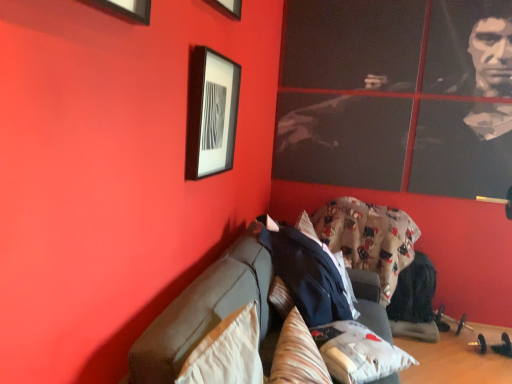
Based on the photo, how much space does fluffy white pillow at lower center, positioned as the first pillow in right-to-left order, occupy vertically?

5.21 inches.

Find the location of a particular element. This screenshot has width=512, height=384. dark gray fabric couch at center is located at coordinates (263, 322).

What is the approximate height of dark gray fabric couch at center?

Answer: It is 34.18 inches.

In order to click on striped fabric pillow at center, acting as the 2th pillow starting from the left in this screenshot , I will do `click(297, 355)`.

From the image's perspective, relative to fluffy white pillow at lower center, the 3th pillow from the left, is fluffy cotton blanket at center above or below?

fluffy cotton blanket at center is above fluffy white pillow at lower center, the 3th pillow from the left.

Based on the photo, is fluffy cotton blanket at center completely or partially outside of fluffy white pillow at lower center, the 3th pillow from the left?

Absolutely, fluffy cotton blanket at center is external to fluffy white pillow at lower center, the 3th pillow from the left.

How different are the orientations of fluffy cotton blanket at center and fluffy white pillow at lower center, the 3th pillow from the left, in degrees?

They differ by 133 degrees in their facing directions.

Is fluffy cotton blanket at center at the left side of fluffy white pillow at lower center, positioned as the first pillow in right-to-left order?

In fact, fluffy cotton blanket at center is to the right of fluffy white pillow at lower center, positioned as the first pillow in right-to-left order.

Which of these two, dark gray fabric couch at center or beige fabric pillow at lower left, placed as the 1th pillow when sorted from left to right, is bigger?

dark gray fabric couch at center is bigger.

Is dark gray fabric couch at center directly adjacent to beige fabric pillow at lower left, which is the third pillow from right to left?

They are not placed beside each other.

Based on the photo, is beige fabric pillow at lower left, placed as the 1th pillow when sorted from left to right, completely or partially inside dark gray fabric couch at center?

That's correct, beige fabric pillow at lower left, placed as the 1th pillow when sorted from left to right, is inside dark gray fabric couch at center.

Considering the sizes of objects dark gray fabric couch at center and beige fabric pillow at lower left, which is the third pillow from right to left, in the image provided, who is shorter, dark gray fabric couch at center or beige fabric pillow at lower left, which is the third pillow from right to left,?

With less height is beige fabric pillow at lower left, which is the third pillow from right to left.

Consider the image. Is fluffy cotton blanket at center aimed at matte black picture frame at upper left?

No, fluffy cotton blanket at center is not oriented towards matte black picture frame at upper left.

In terms of size, does fluffy cotton blanket at center appear bigger or smaller than matte black picture frame at upper left?

In the image, fluffy cotton blanket at center appears to be larger than matte black picture frame at upper left.

Is fluffy cotton blanket at center to the left of matte black picture frame at upper left from the viewer's perspective?

No.

What's the angular difference between fluffy cotton blanket at center and matte black picture frame at upper left's facing directions?

89.9 degrees.

Is beige fabric pillow at lower left, which is the third pillow from right to left, taller than fluffy cotton blanket at center?

Incorrect, the height of beige fabric pillow at lower left, which is the third pillow from right to left, is not larger of that of fluffy cotton blanket at center.

Is point (237, 328) positioned after point (376, 213)?

No, it is in front of (376, 213).

From the image's perspective, is beige fabric pillow at lower left, placed as the 1th pillow when sorted from left to right, above or below fluffy cotton blanket at center?

Clearly, from the image's perspective, beige fabric pillow at lower left, placed as the 1th pillow when sorted from left to right, is below fluffy cotton blanket at center.

Considering the relative sizes of beige fabric pillow at lower left, which is the third pillow from right to left, and fluffy cotton blanket at center in the image provided, is beige fabric pillow at lower left, which is the third pillow from right to left, thinner than fluffy cotton blanket at center?

Yes.

Considering the sizes of fluffy white pillow at lower center, the 3th pillow from the left, and dark gray fabric couch at center in the image, is fluffy white pillow at lower center, the 3th pillow from the left, wider or thinner than dark gray fabric couch at center?

Clearly, fluffy white pillow at lower center, the 3th pillow from the left, has less width compared to dark gray fabric couch at center.

Is fluffy white pillow at lower center, the 3th pillow from the left, to the right of dark gray fabric couch at center from the viewer's perspective?

Yes, fluffy white pillow at lower center, the 3th pillow from the left, is to the right of dark gray fabric couch at center.

Can you confirm if fluffy white pillow at lower center, the 3th pillow from the left, is taller than dark gray fabric couch at center?

In fact, fluffy white pillow at lower center, the 3th pillow from the left, may be shorter than dark gray fabric couch at center.

How much distance is there between fluffy white pillow at lower center, positioned as the first pillow in right-to-left order, and dark gray fabric couch at center?

fluffy white pillow at lower center, positioned as the first pillow in right-to-left order, is 9.15 inches from dark gray fabric couch at center.

From the image's perspective, is striped fabric pillow at center, acting as the 2th pillow starting from the left, above matte black picture frame at upper left?

Actually, striped fabric pillow at center, acting as the 2th pillow starting from the left, appears below matte black picture frame at upper left in the image.

Looking at the image, does striped fabric pillow at center, acting as the 2th pillow starting from the left, seem bigger or smaller compared to matte black picture frame at upper left?

Considering their sizes, striped fabric pillow at center, acting as the 2th pillow starting from the left, takes up more space than matte black picture frame at upper left.

From a real-world perspective, is striped fabric pillow at center, which is the 2th pillow in right-to-left order, beneath matte black picture frame at upper left?

Yes, from a real-world perspective, striped fabric pillow at center, which is the 2th pillow in right-to-left order, is under matte black picture frame at upper left.

Is matte black picture frame at upper left a part of striped fabric pillow at center, acting as the 2th pillow starting from the left?

Definitely not — matte black picture frame at upper left is not inside striped fabric pillow at center, acting as the 2th pillow starting from the left.

From a real-world perspective, is striped fabric pillow at center, acting as the 2th pillow starting from the left, below fluffy cotton blanket at center?

No, from a real-world perspective, striped fabric pillow at center, acting as the 2th pillow starting from the left, is not below fluffy cotton blanket at center.

Where is `blanket beneath the striped fabric pillow at center, which is the 2th pillow in right-to-left order (from a real-world perspective)`? The image size is (512, 384). blanket beneath the striped fabric pillow at center, which is the 2th pillow in right-to-left order (from a real-world perspective) is located at coordinates (369, 238).

Is striped fabric pillow at center, acting as the 2th pillow starting from the left, at the left side of fluffy cotton blanket at center?

Yes, striped fabric pillow at center, acting as the 2th pillow starting from the left, is to the left of fluffy cotton blanket at center.

Which object is closer to the camera, striped fabric pillow at center, acting as the 2th pillow starting from the left, or fluffy cotton blanket at center?

striped fabric pillow at center, acting as the 2th pillow starting from the left, is in front.

You are a GUI agent. You are given a task and a screenshot of the screen. Output one action in this format:
    pyautogui.click(x=<x>, y=<y>)
    Task: Click on the pillow that is the 3rd object located below the fluffy cotton blanket at center (from the image's perspective)
    The width and height of the screenshot is (512, 384).
    Given the screenshot: What is the action you would take?
    pyautogui.click(x=358, y=352)

Where is `the 1st pillow behind the dark gray fabric couch at center, starting your count from the anchor`? the 1st pillow behind the dark gray fabric couch at center, starting your count from the anchor is located at coordinates (227, 352).

Estimate the real-world distances between objects in this image. Which object is further from dark gray fabric couch at center, striped fabric pillow at center, acting as the 2th pillow starting from the left, or beige fabric pillow at lower left, placed as the 1th pillow when sorted from left to right?

Among the two, beige fabric pillow at lower left, placed as the 1th pillow when sorted from left to right, is located further to dark gray fabric couch at center.

From the image, which object appears to be farther from matte black picture frame at upper left, fluffy white pillow at lower center, the 3th pillow from the left, or fluffy cotton blanket at center?

The object further to matte black picture frame at upper left is fluffy cotton blanket at center.

From the image, which object appears to be nearer to striped fabric pillow at center, which is the 2th pillow in right-to-left order, dark gray fabric couch at center or beige fabric pillow at lower left, placed as the 1th pillow when sorted from left to right?

beige fabric pillow at lower left, placed as the 1th pillow when sorted from left to right.

Which object lies nearer to the anchor point fluffy white pillow at lower center, positioned as the first pillow in right-to-left order, dark gray fabric couch at center or matte black picture frame at upper left?

Based on the image, dark gray fabric couch at center appears to be nearer to fluffy white pillow at lower center, positioned as the first pillow in right-to-left order.

When comparing their distances from striped fabric pillow at center, which is the 2th pillow in right-to-left order, does beige fabric pillow at lower left, placed as the 1th pillow when sorted from left to right, or matte black picture frame at upper left seem closer?

beige fabric pillow at lower left, placed as the 1th pillow when sorted from left to right, lies closer to striped fabric pillow at center, which is the 2th pillow in right-to-left order, than the other object.

Which object lies further to the anchor point fluffy white pillow at lower center, positioned as the first pillow in right-to-left order, striped fabric pillow at center, acting as the 2th pillow starting from the left, or matte black picture frame at upper left?

matte black picture frame at upper left is positioned further to the anchor fluffy white pillow at lower center, positioned as the first pillow in right-to-left order.

Which object lies nearer to the anchor point dark gray fabric couch at center, beige fabric pillow at lower left, placed as the 1th pillow when sorted from left to right, or matte black picture frame at upper left?

beige fabric pillow at lower left, placed as the 1th pillow when sorted from left to right.

Estimate the real-world distances between objects in this image. Which object is closer to fluffy white pillow at lower center, positioned as the first pillow in right-to-left order, matte black picture frame at upper left or fluffy cotton blanket at center?

matte black picture frame at upper left lies closer to fluffy white pillow at lower center, positioned as the first pillow in right-to-left order, than the other object.

Where is `pillow between matte black picture frame at upper left and fluffy cotton blanket at center in the front-back direction`? The width and height of the screenshot is (512, 384). pillow between matte black picture frame at upper left and fluffy cotton blanket at center in the front-back direction is located at coordinates (358, 352).

Locate an element on the screen. Image resolution: width=512 pixels, height=384 pixels. picture frame located between beige fabric pillow at lower left, placed as the 1th pillow when sorted from left to right, and fluffy cotton blanket at center in the depth direction is located at coordinates (211, 113).

Locate an element on the screen. picture frame positioned between dark gray fabric couch at center and fluffy cotton blanket at center from near to far is located at coordinates coord(211,113).

Locate an element on the screen. This screenshot has width=512, height=384. pillow located between striped fabric pillow at center, acting as the 2th pillow starting from the left, and fluffy cotton blanket at center in the depth direction is located at coordinates (358, 352).